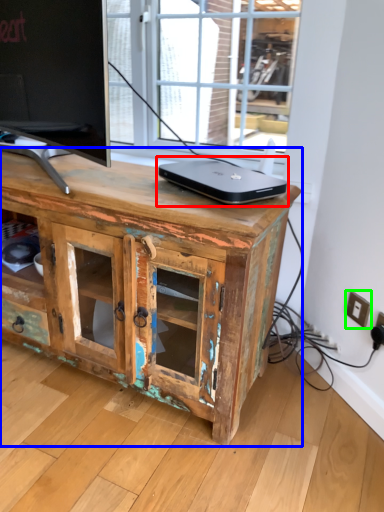
Question: Based on their relative distances, which object is nearer to laptop (highlighted by a red box)? Choose from chest of drawers (highlighted by a blue box) and electric outlet (highlighted by a green box).

Choices:
 (A) chest of drawers
 (B) electric outlet

Answer: (A)